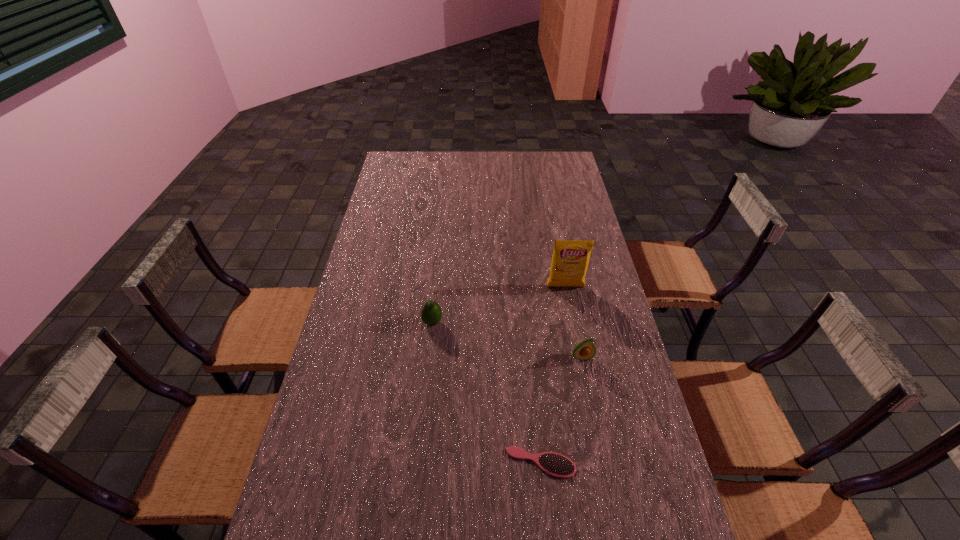
Find the location of a particular element. free space between the hairbrush and the tallest object is located at coordinates (553, 375).

The height and width of the screenshot is (540, 960). Identify the location of empty space that is in between the left avocado and the shortest object. (487, 393).

The height and width of the screenshot is (540, 960). In order to click on vacant area between the crisp (potato chip) and the shortest object in this screenshot , I will do `click(553, 375)`.

Identify the location of vacant space that is in between the tallest object and the nearer avocado. The image size is (960, 540). (574, 322).

Identify the location of free spot between the right avocado and the leftmost object. (507, 340).

Locate an element on the screen. vacant area that lies between the tallest object and the nearest object is located at coordinates (553, 375).

Find the location of a particular element. The height and width of the screenshot is (540, 960). vacant point located between the crisp (potato chip) and the farther avocado is located at coordinates (499, 305).

This screenshot has height=540, width=960. I want to click on empty space that is in between the tallest object and the nearer avocado, so click(x=574, y=322).

Identify the location of object that stands as the closest to the farthest object. (585, 350).

This screenshot has height=540, width=960. What are the coordinates of `object that is the closest to the shortest object` in the screenshot? It's located at (585, 350).